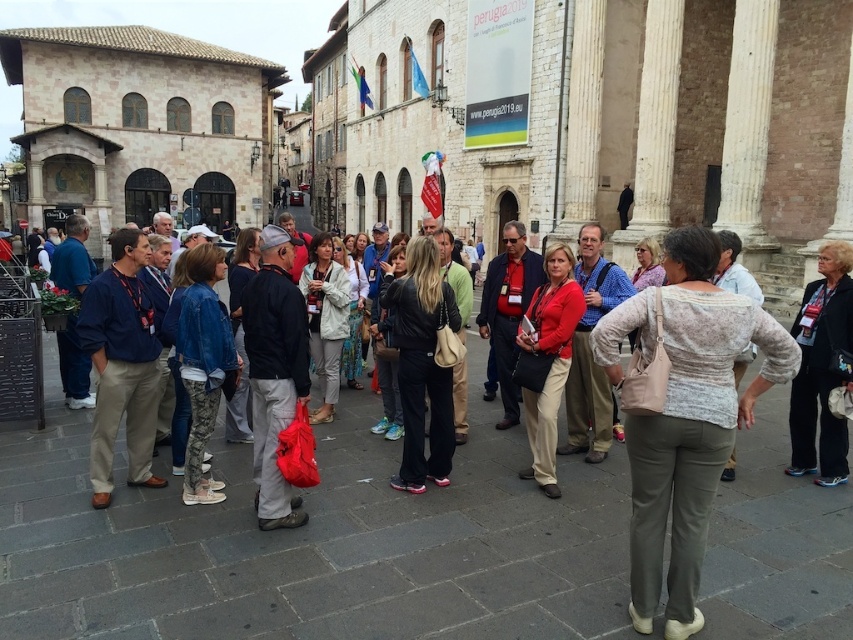
You are a photographer trying to capture a closeup of the black leather jacket at center without the denim jacket at center blocking the view. Is this possible given their current positions?

The black leather jacket at center is positioned over the denim jacket at center, so it is blocking the view. You cannot capture a closeup of the black leather jacket at center without the denim jacket at center in the shot.

You are standing at point (347, 259) and want to move to point (129, 253). Is the path between these two points clear of any obstacles?

Yes, the path between point (129, 253) and point (347, 259) is clear because point (129, 253) is in front of point (347, 259), indicating no obstruction between them.

You are a photographer trying to capture a group photo of the black leather jacket at center and the light gray sweater at center. Since you want both to appear equally prominent in the photo, which subject should you move closer to the camera?

To make both the black leather jacket at center and the light gray sweater at center appear equally prominent in the photo, you should move closer to the black leather jacket at center because it has a smaller size compared to the light gray sweater at center. This will help balance their sizes in the frame.